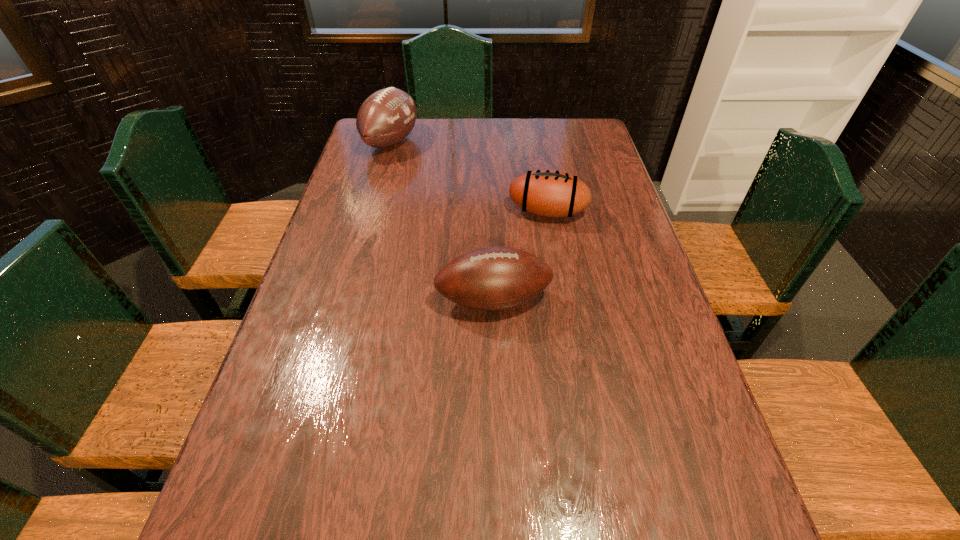
At what (x,y) coordinates should I click in order to perform the action: click on object at the far left corner. Please return your answer as a coordinate pair (x, y). Looking at the image, I should click on click(x=386, y=117).

This screenshot has width=960, height=540. What are the coordinates of `vacant space at the far edge of the desktop` in the screenshot? It's located at point(442,118).

The width and height of the screenshot is (960, 540). Identify the location of free location at the left edge of the desktop. (375, 199).

At what (x,y) coordinates should I click in order to perform the action: click on free region at the right edge. Please return your answer as a coordinate pair (x, y). The height and width of the screenshot is (540, 960). Looking at the image, I should click on (599, 209).

Where is `free point between the second nearest object and the farthest object`? This screenshot has width=960, height=540. free point between the second nearest object and the farthest object is located at coordinates (469, 177).

The image size is (960, 540). Identify the location of object that is the closest to the second farthest football (American). (494, 278).

I want to click on object that stands as the closest to the nearest football (American), so click(548, 193).

Select which football (American) is the second closest to the second nearest football (American). Please provide its 2D coordinates. Your answer should be formatted as a tuple, i.e. [(x, y)], where the tuple contains the x and y coordinates of a point satisfying the conditions above.

[(386, 117)]

What are the coordinates of `football (American) that is the second closest one to the nearest object` in the screenshot? It's located at (386, 117).

Where is `vacant area in the image that satisfies the following two spatial constraints: 1. on the front side of the nearest object; 2. on the right side of the leftmost football (American)`? vacant area in the image that satisfies the following two spatial constraints: 1. on the front side of the nearest object; 2. on the right side of the leftmost football (American) is located at coordinates (348, 300).